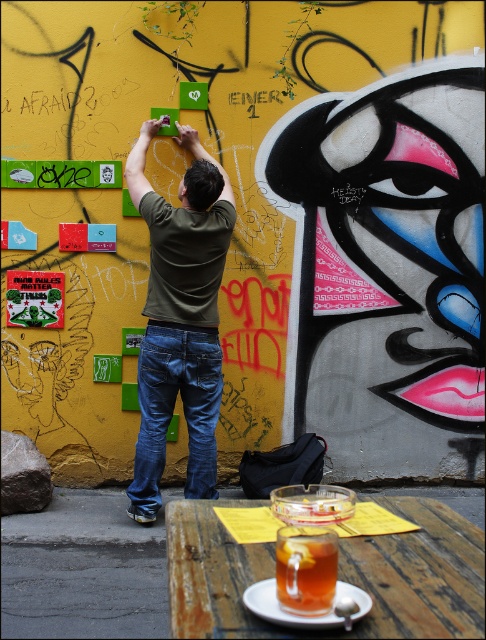
You are standing at the camera position looking at the colorful wall with graffiti and stickers. There is a point marked at coordinates (157, 392) on the wall. If you want to touch this point with a 3.5 meter long pole, will you be able to reach it?

The point at (157, 392) is 4.04 meters away from the camera. Since the pole is only 3.5 meters long, you cannot reach the point with the pole.